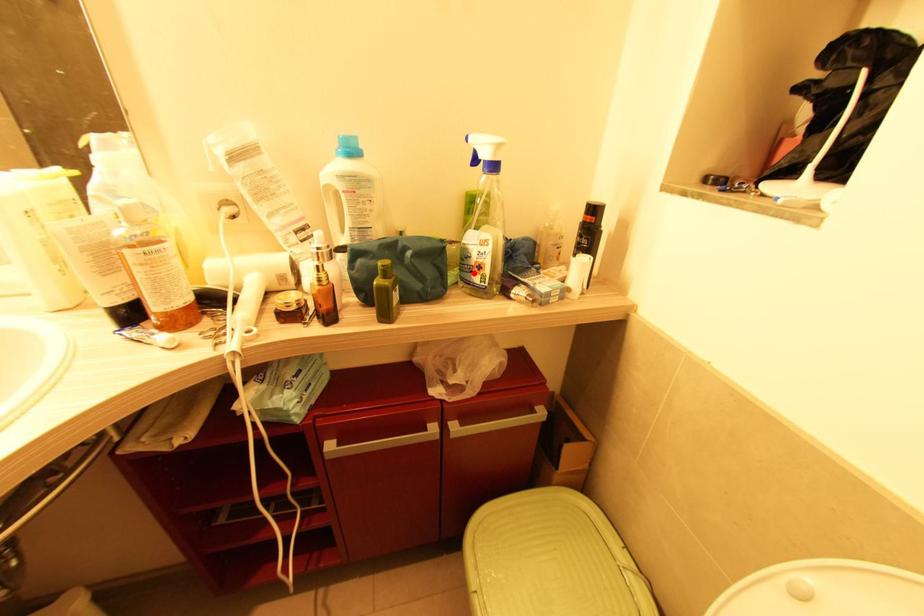
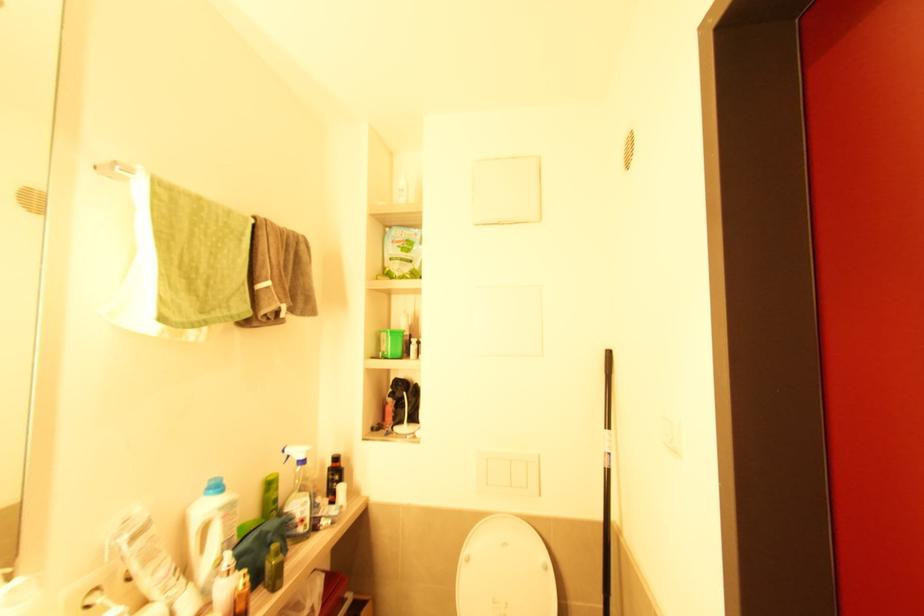
In the second image, find the point that corresponds to the highlighted location in the first image.

(298, 527)